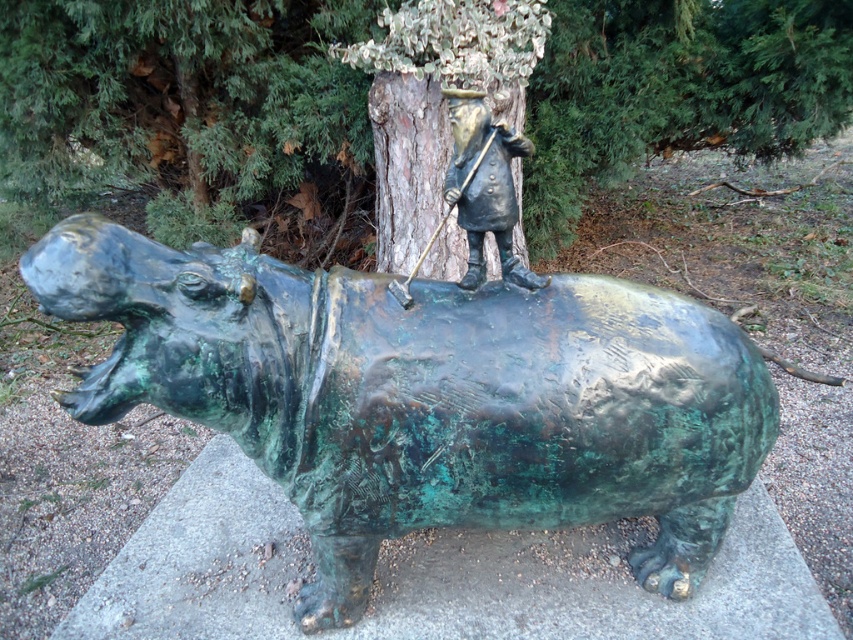
You are a visitor at an outdoor sculpture garden. You see the green patina hippo at center and the green textured tree trunk at center. Which object is taller?

The green textured tree trunk at center is taller than the green patina hippo at center.

You are an art conservator examining the sculpture. You notice a specific point labeled as point [425,396]. Which part of the sculpture does this point most likely correspond to?

The point [425,396] corresponds to the green patina hippo at center.

You are standing in front of the bronze hippopotamus sculpture with the small figure on its back. There is a point labeled at coordinates [173,104]. Based on the scene description, what object or feature is located at that point?

The point at coordinates [173,104] indicates the green textured tree trunk at center.